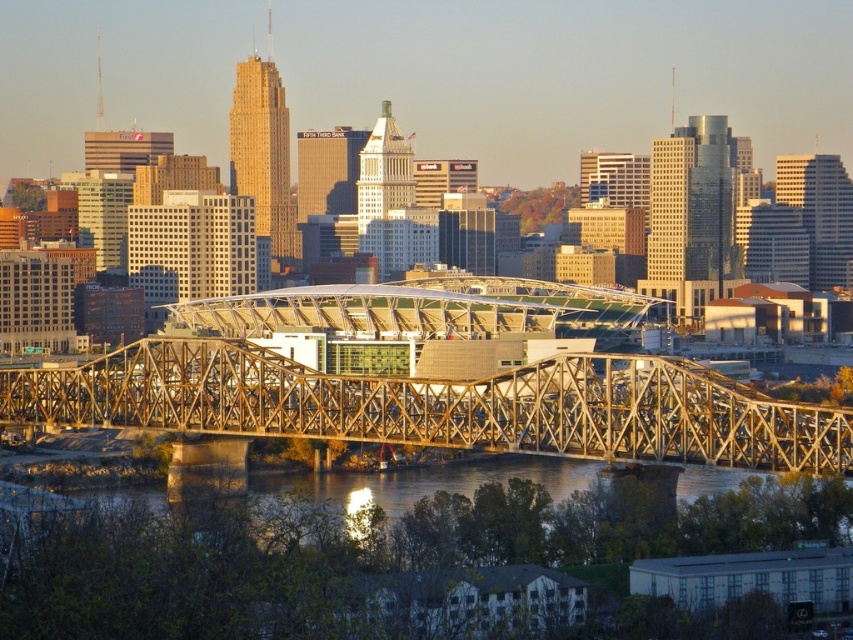
What are the coordinates of `golden metallic bridge at center` in the screenshot? It's located at (440, 404).

Does golden metallic bridge at center appear under greenish water at lower center?

Actually, golden metallic bridge at center is above greenish water at lower center.

Find the location of a particular element. golden metallic bridge at center is located at coordinates (440, 404).

You are a GUI agent. You are given a task and a screenshot of the screen. Output one action in this format:
    pyautogui.click(x=<x>, y=<y>)
    Task: Click on the golden metallic bridge at center
    This screenshot has width=853, height=640.
    Given the screenshot: What is the action you would take?
    pyautogui.click(x=440, y=404)